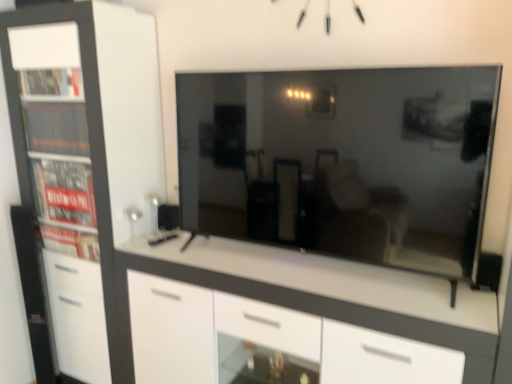
Question: Should I look upward or downward to see white glossy chest of drawers at center?

Choices:
 (A) down
 (B) up

Answer: (A)

Question: Is white glossy chest of drawers at center positioned behind matte black tv at center?

Choices:
 (A) no
 (B) yes

Answer: (B)

Question: Is white glossy chest of drawers at center outside matte black tv at center?

Choices:
 (A) no
 (B) yes

Answer: (B)

Question: Can you confirm if white glossy chest of drawers at center is wider than matte black tv at center?

Choices:
 (A) yes
 (B) no

Answer: (A)

Question: Is white glossy chest of drawers at center bigger than matte black tv at center?

Choices:
 (A) yes
 (B) no

Answer: (A)

Question: Is white glossy chest of drawers at center facing away from matte black tv at center?

Choices:
 (A) yes
 (B) no

Answer: (B)

Question: Could you tell me if white glossy chest of drawers at center is turned towards matte black tv at center?

Choices:
 (A) no
 (B) yes

Answer: (A)

Question: Could you tell me if matte black tv at center is facing white glossy chest of drawers at center?

Choices:
 (A) yes
 (B) no

Answer: (B)

Question: Can you confirm if matte black tv at center is positioned to the left of white glossy chest of drawers at center?

Choices:
 (A) no
 (B) yes

Answer: (A)

Question: From a real-world perspective, is matte black tv at center located higher than white glossy chest of drawers at center?

Choices:
 (A) yes
 (B) no

Answer: (A)

Question: From the image's perspective, is matte black tv at center located above white glossy chest of drawers at center?

Choices:
 (A) no
 (B) yes

Answer: (B)

Question: Does matte black tv at center have a lesser height compared to white glossy chest of drawers at center?

Choices:
 (A) no
 (B) yes

Answer: (B)

Question: From a real-world perspective, is matte black tv at center located beneath white glossy chest of drawers at center?

Choices:
 (A) yes
 (B) no

Answer: (B)

Question: Is matte black tv at center looking in the opposite direction of white matte cabinet at left?

Choices:
 (A) no
 (B) yes

Answer: (A)